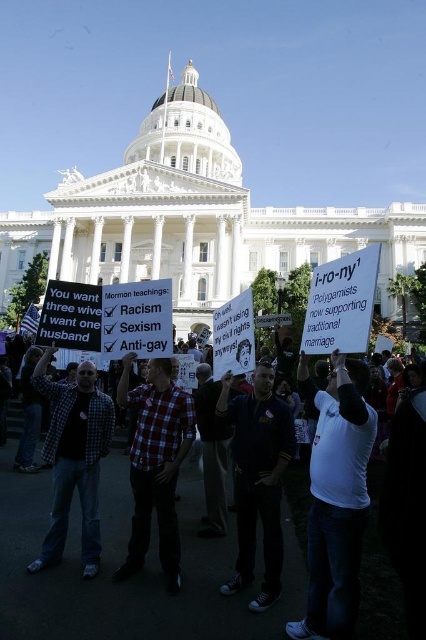
From the picture: You are a photographer standing at the edge of the protest area. You want to take a photo that includes both the white paper signs at center and the plaid shirt at center. Given that your camera has a maximum focus range of 5 meters, will you be able to capture both subjects clearly in the same frame?

The distance between the white paper signs at center and the plaid shirt at center is 6.61 meters. Since your camera can only focus within 5 meters, you won not be able to capture both subjects clearly in the same frame.